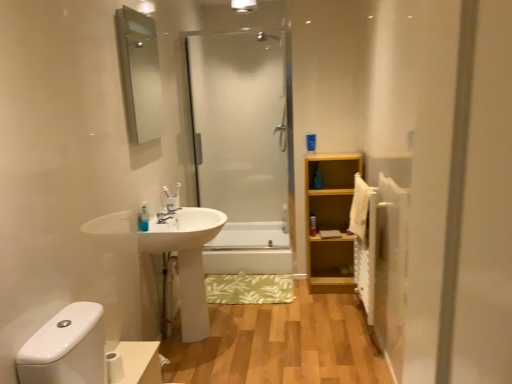
Question: Is clear glass mirror at upper left surrounding translucent plastic soap at left, the 2th toiletry from the back?

Choices:
 (A) no
 (B) yes

Answer: (A)

Question: Is clear glass mirror at upper left smaller than translucent plastic soap at left, the 2th toiletry from the back?

Choices:
 (A) no
 (B) yes

Answer: (A)

Question: Is clear glass mirror at upper left aimed at translucent plastic soap at left, the 2th toiletry from the back?

Choices:
 (A) no
 (B) yes

Answer: (A)

Question: Is clear glass mirror at upper left far away from translucent plastic soap at left, marked as the first toiletry in a left-to-right arrangement?

Choices:
 (A) no
 (B) yes

Answer: (B)

Question: Does clear glass mirror at upper left appear on the right side of translucent plastic soap at left, marked as the 2th toiletry in a right-to-left arrangement?

Choices:
 (A) yes
 (B) no

Answer: (B)

Question: Is white glossy bathtub at center taller or shorter than transparent glass shower door at center?

Choices:
 (A) tall
 (B) short

Answer: (B)

Question: Looking at their shapes, would you say white glossy bathtub at center is wider or thinner than transparent glass shower door at center?

Choices:
 (A) thin
 (B) wide

Answer: (B)

Question: In the image, is white glossy bathtub at center on the left side or the right side of transparent glass shower door at center?

Choices:
 (A) left
 (B) right

Answer: (B)

Question: Is white glossy bathtub at center in front of or behind transparent glass shower door at center in the image?

Choices:
 (A) behind
 (B) front

Answer: (A)

Question: From a real-world perspective, is white textured radiator at right above or below white glossy sink at center left?

Choices:
 (A) below
 (B) above

Answer: (B)

Question: From the image's perspective, is white textured radiator at right located above or below white glossy sink at center left?

Choices:
 (A) below
 (B) above

Answer: (B)

Question: In the image, is white textured radiator at right positioned in front of or behind white glossy sink at center left?

Choices:
 (A) behind
 (B) front

Answer: (B)

Question: Do you think white textured radiator at right is within white glossy sink at center left, or outside of it?

Choices:
 (A) outside
 (B) inside

Answer: (A)

Question: From a real-world perspective, relative to white glossy sink at center left, is translucent plastic soap at left, placed as the first toiletry when sorted from front to back, vertically above or below?

Choices:
 (A) above
 (B) below

Answer: (A)

Question: In terms of width, does translucent plastic soap at left, marked as the 2th toiletry in a right-to-left arrangement, look wider or thinner when compared to white glossy sink at center left?

Choices:
 (A) wide
 (B) thin

Answer: (B)